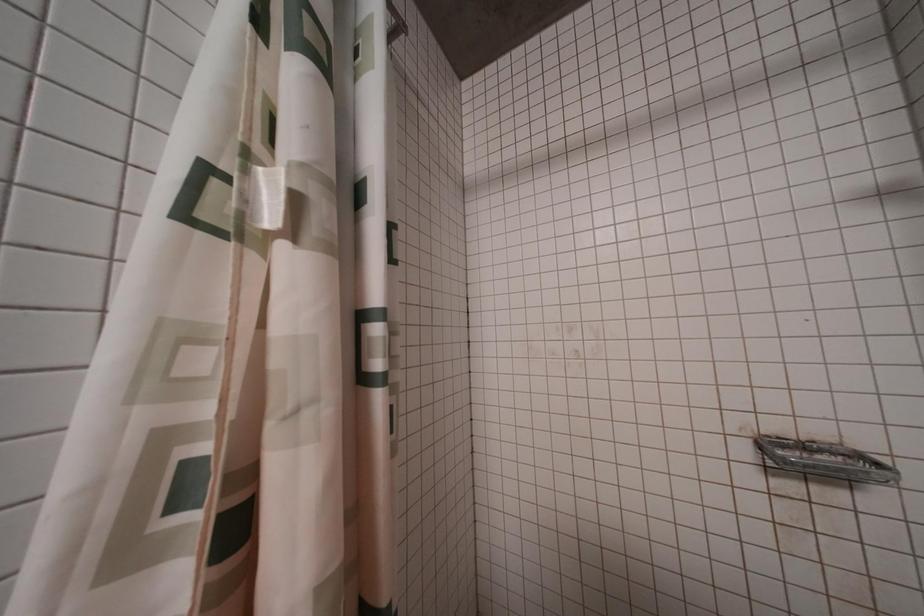
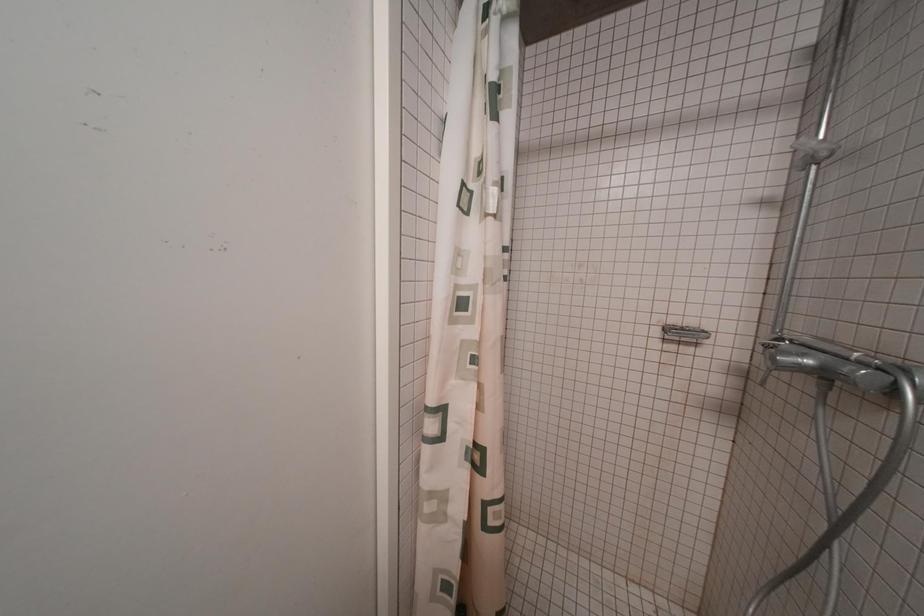
From the picture: The images are taken continuously from a first-person perspective. In which direction are you moving?

The cameraman moved toward left, backward.